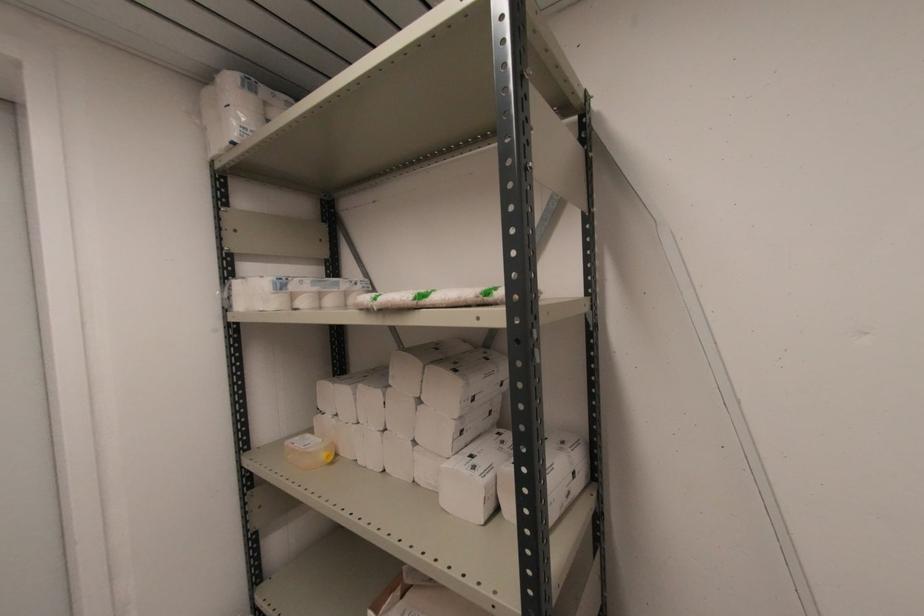
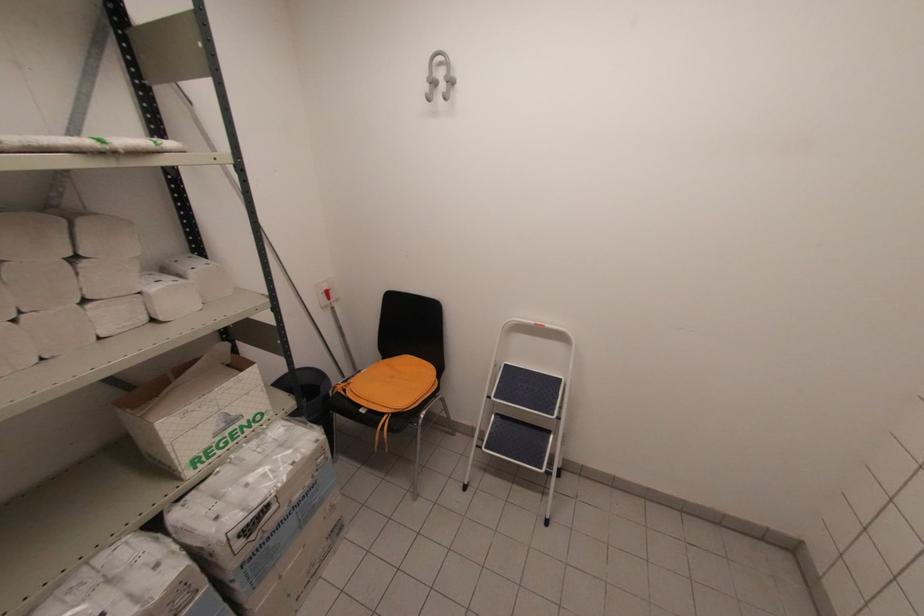
Where in the second image is the point corresponding to point (419, 397) from the first image?

(71, 254)